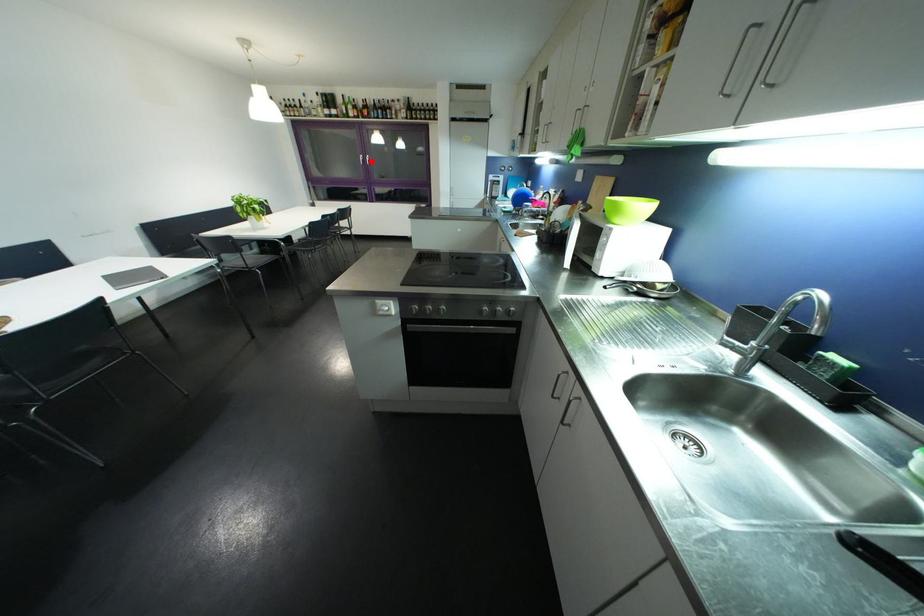
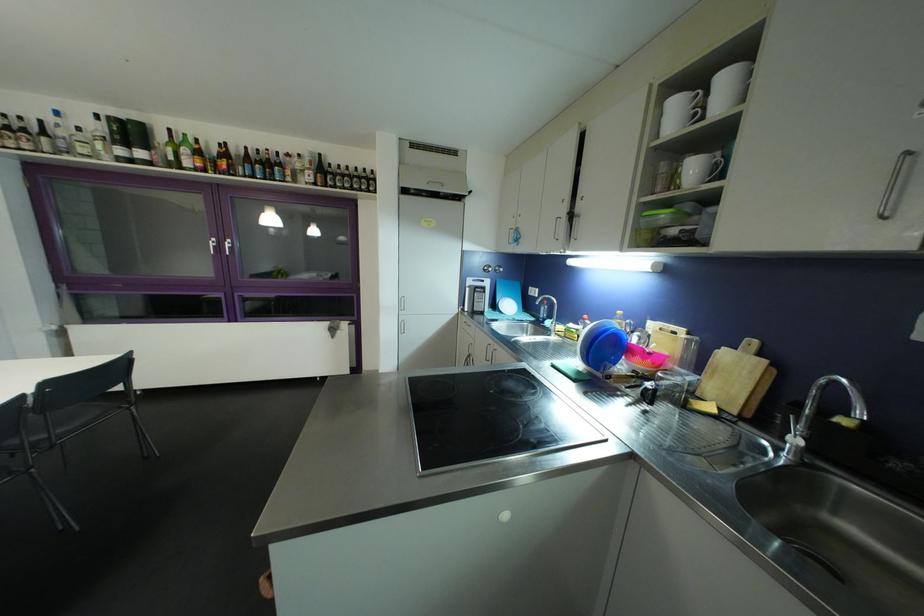
Locate, in the second image, the point that corresponds to the highlighted location in the first image.

(227, 246)